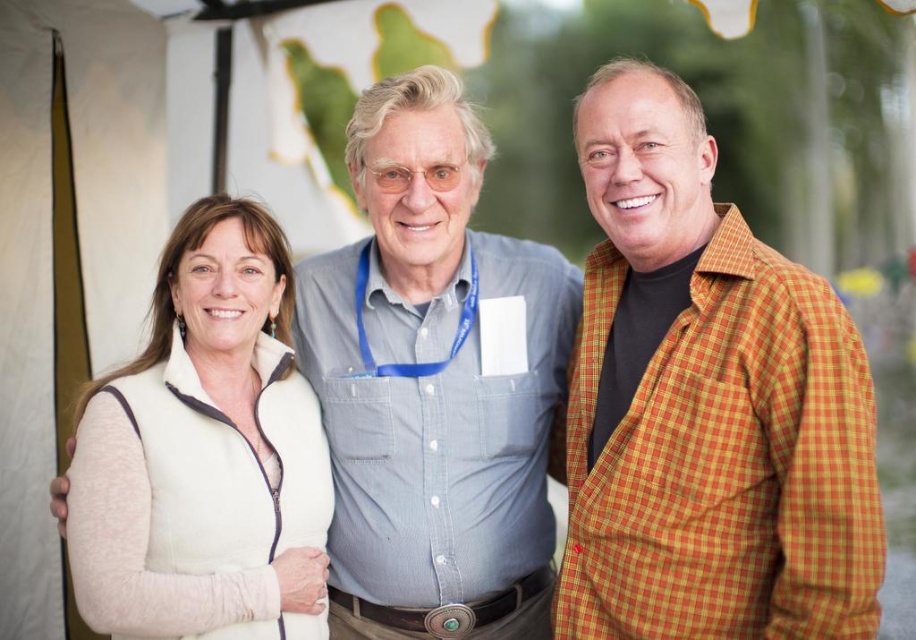
Question: From the image, what is the correct spatial relationship of orange checkered jacket at right in relation to white fleece vest at left?

Choices:
 (A) below
 (B) above

Answer: (B)

Question: Among these objects, which one is nearest to the camera?

Choices:
 (A) light blue button-down shirt at center
 (B) orange checkered jacket at right
 (C) white fleece vest at left

Answer: (B)

Question: Is orange checkered jacket at right positioned at the back of light blue button-down shirt at center?

Choices:
 (A) yes
 (B) no

Answer: (B)

Question: Based on their relative distances, which object is farther from the light blue button-down shirt at center?

Choices:
 (A) white fleece vest at left
 (B) orange checkered jacket at right

Answer: (B)

Question: Which point is farther to the camera?

Choices:
 (A) orange checkered jacket at right
 (B) light blue button-down shirt at center

Answer: (B)

Question: Is light blue button-down shirt at center positioned behind white fleece vest at left?

Choices:
 (A) no
 (B) yes

Answer: (B)